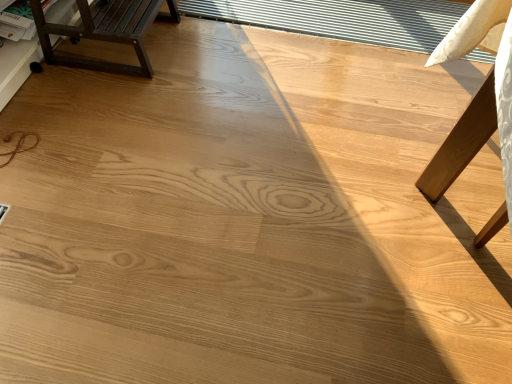
Locate an element on the screen. vacant area that lies in front of matte dark brown wooden bench at upper left is located at coordinates (100, 104).